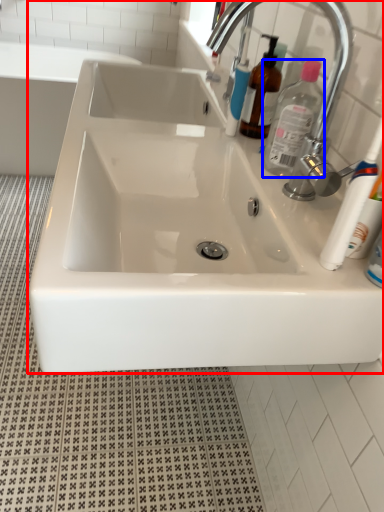
Question: Which of the following is the closest to the observer, sink (highlighted by a red box) or cleaning product (highlighted by a blue box)?

Choices:
 (A) sink
 (B) cleaning product

Answer: (A)